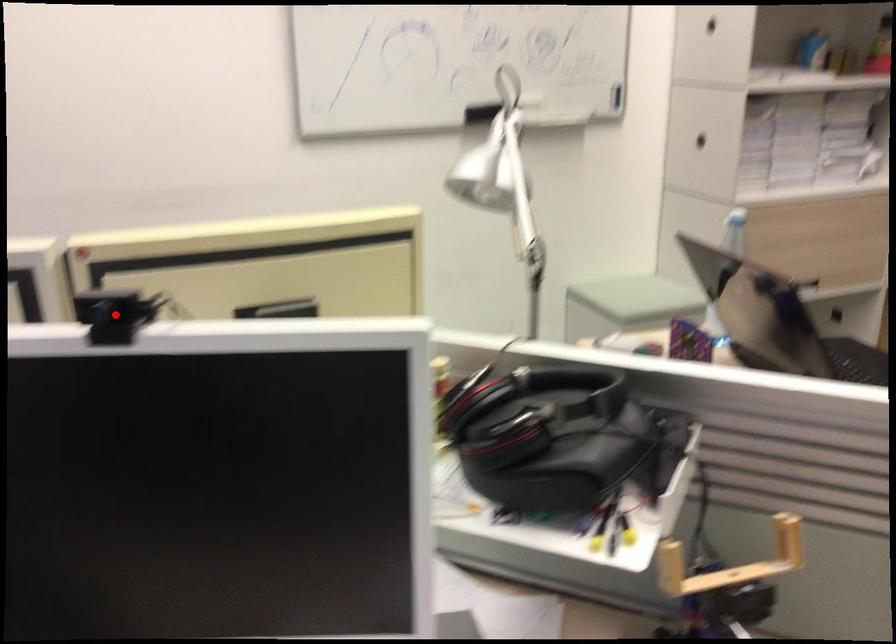
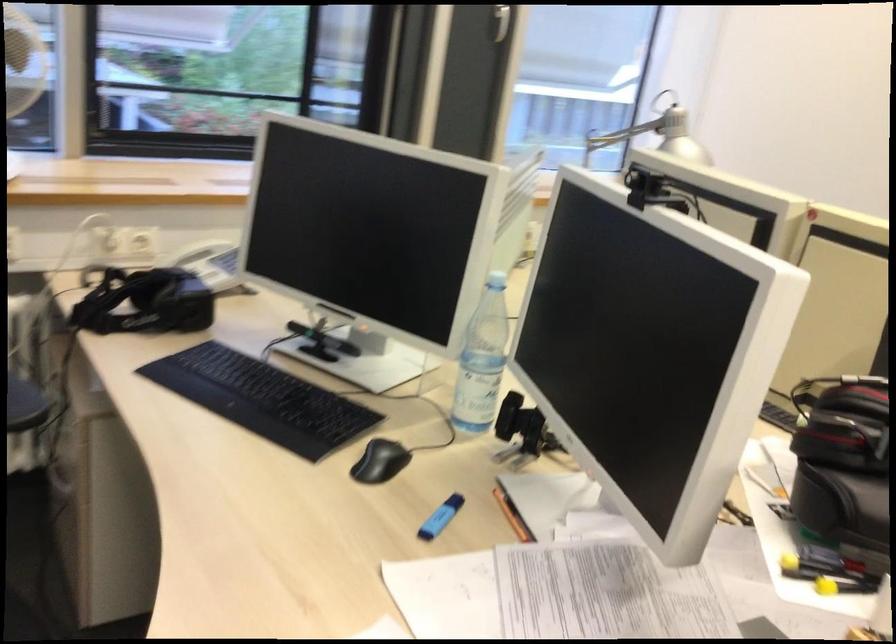
Question: I am providing you with two images of the same scene from different viewpoints. A red point is marked on the first image. Can you still see the location of the red point in image 2?

Choices:
 (A) Yes
 (B) No

Answer: (B)